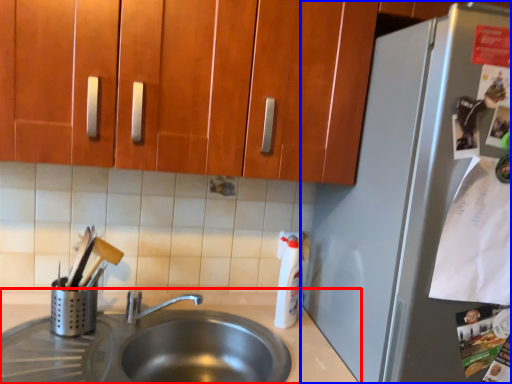
Question: Which object appears farthest to the camera in this image, countertop (highlighted by a red box) or refrigerator (highlighted by a blue box)?

Choices:
 (A) countertop
 (B) refrigerator

Answer: (A)